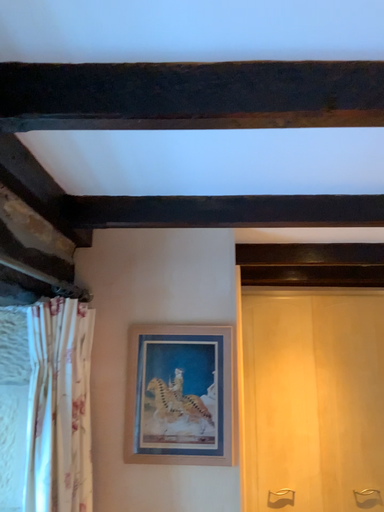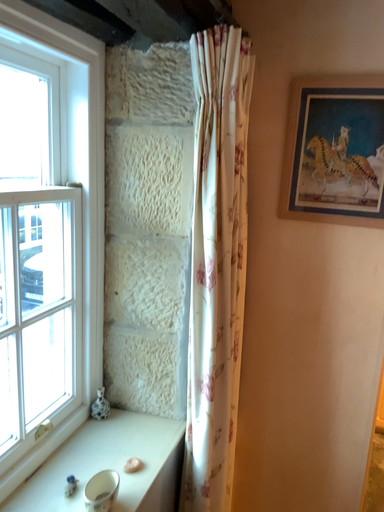
Question: How did the camera likely rotate when shooting the video?

Choices:
 (A) rotated right
 (B) rotated left

Answer: (B)